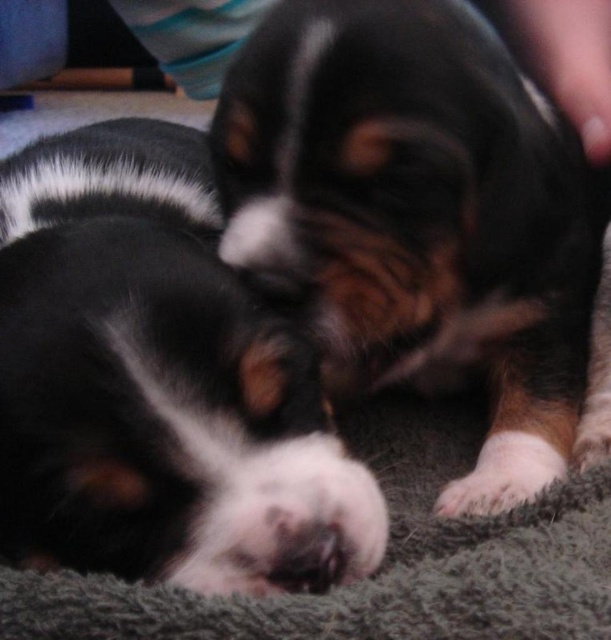
Based on the photo, you are a dog breeder who wants to place both puppies in a playpen. The playpen can only accommodate one large dog or two small dogs. Based on the image, can both black fur dog at center and white fur at lower right fit in the playpen together?

The black fur dog at center is bigger than white fur at lower right, so the playpen can only hold two small dogs. Since the black fur dog at center is larger, it would require the playpen space meant for one large dog. Therefore, both puppies cannot fit together in the playpen.

You are a photographer trying to capture a closeup shot of the black fur dog at center. Since the gray fuzzy blanket at lower center is in the way, can you move the blanket to get a better view? Explain why or why not based on their sizes.

The black fur dog at center is bigger than the gray fuzzy blanket at lower center. Therefore, the gray fuzzy blanket at lower center is smaller and can be moved out of the way to get a better view of the black fur dog at center.